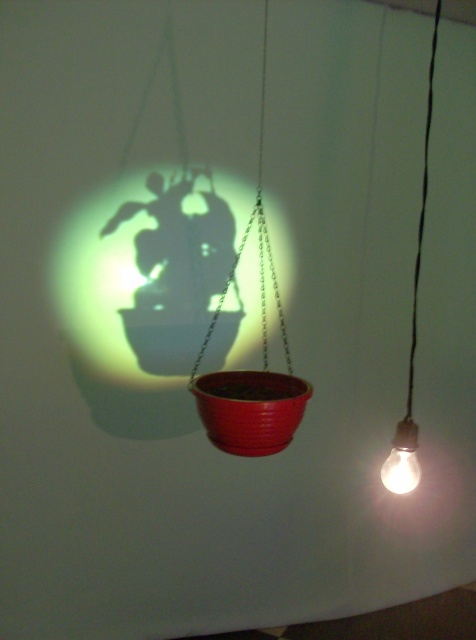
You are an interior designer planning to adjust the lighting in a room. You have the matte plastic plant at center and the matte white bulb at lower right. If you want to move the bulb to a position where its light can shine directly on the plant without obstruction, should you move it forward or backward relative to the current position?

The matte white bulb at lower right is currently behind the matte plastic plant at center, so to shine light directly on the plant without obstruction, you should move the bulb forward so it is in front of the matte plastic plant at center.